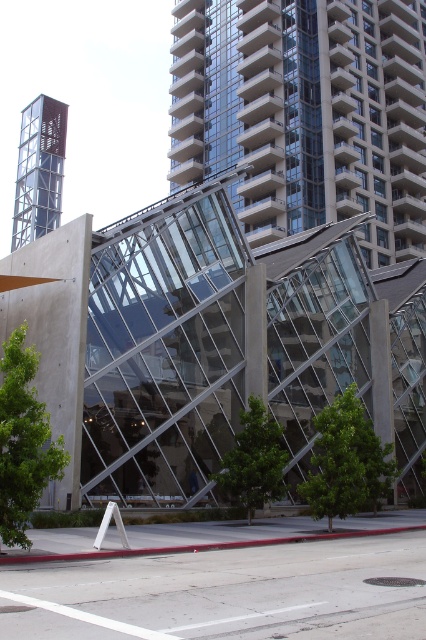
Question: Is glassy concrete building at upper center to the right of clear glass elevator at upper left from the viewer's perspective?

Choices:
 (A) no
 (B) yes

Answer: (B)

Question: Observing the image, what is the correct spatial positioning of glassy concrete building at upper center in reference to clear glass elevator at upper left?

Choices:
 (A) left
 (B) right

Answer: (B)

Question: Is glassy concrete building at upper center in front of clear glass elevator at upper left?

Choices:
 (A) yes
 (B) no

Answer: (A)